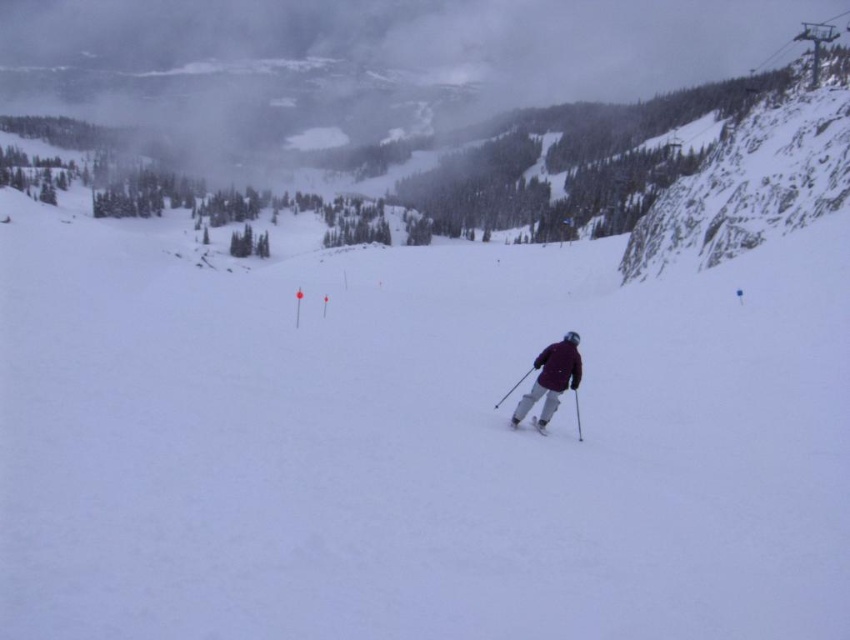
Question: Can you confirm if maroon fabric jacket at center is positioned below matte gray ski at center?

Choices:
 (A) no
 (B) yes

Answer: (A)

Question: Does maroon fabric jacket at center appear over matte gray ski at center?

Choices:
 (A) yes
 (B) no

Answer: (A)

Question: Which point is closer to the camera?

Choices:
 (A) (544, 428)
 (B) (578, 356)

Answer: (A)

Question: Does maroon fabric jacket at center have a smaller size compared to matte gray ski at center?

Choices:
 (A) no
 (B) yes

Answer: (A)

Question: Among these objects, which one is farthest from the camera?

Choices:
 (A) matte gray ski at center
 (B) maroon fabric jacket at center

Answer: (B)